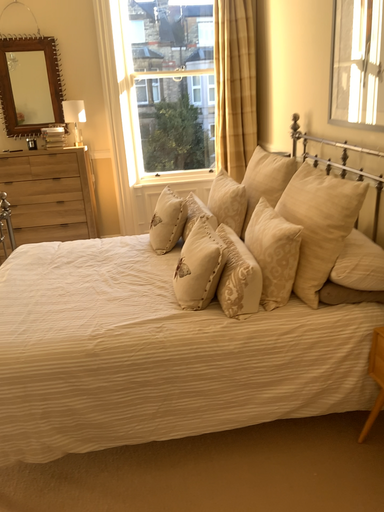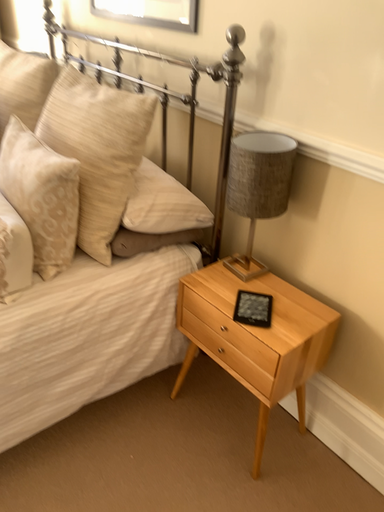
Question: How did the camera likely rotate when shooting the video?

Choices:
 (A) rotated upward
 (B) rotated downward

Answer: (B)